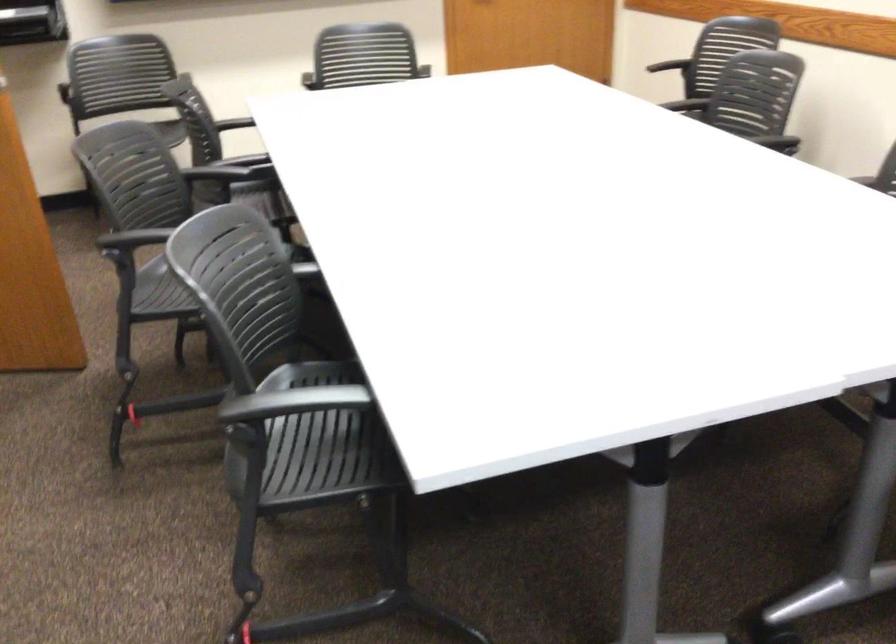
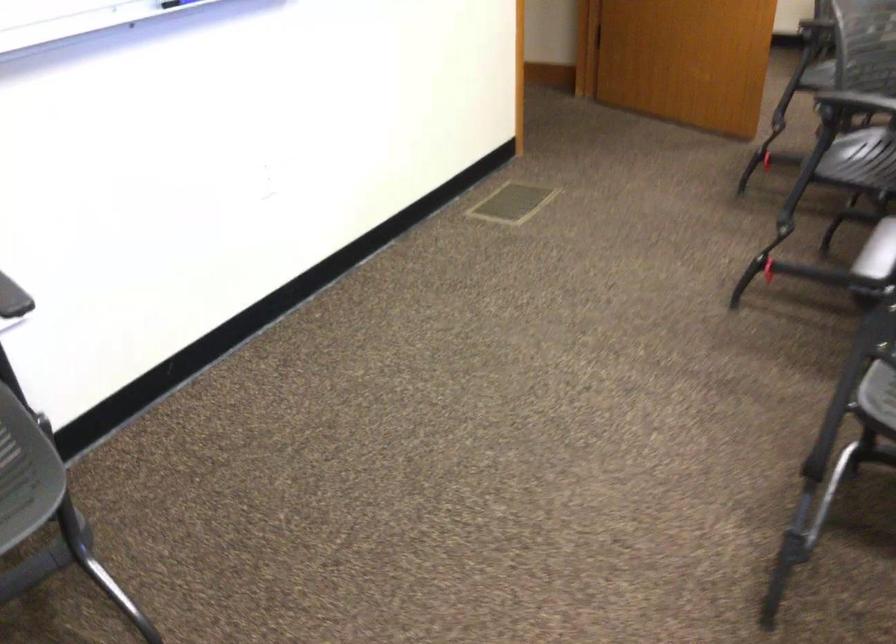
Locate, in the second image, the point that corresponds to (325,430) in the first image.

(860, 160)